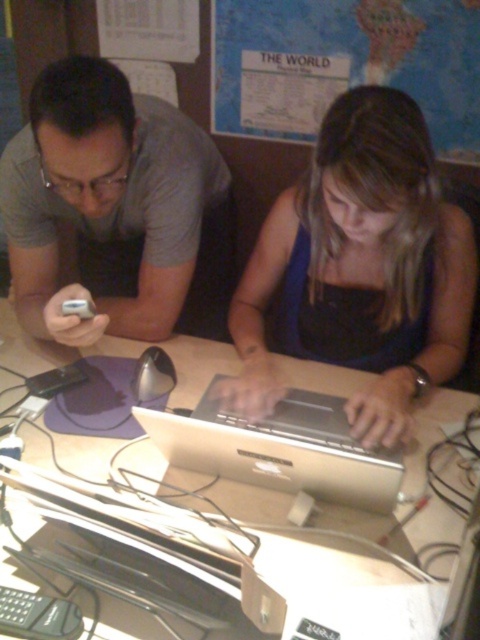
You are an interior designer assessing the desk space. The matte gray shirt at left and the white glossy table at center are both in your view. Which object is larger in size?

The matte gray shirt at left is smaller than the white glossy table at center, so the white glossy table at center is larger in size.

You are a photographer taking a picture of the scene. The matte gray shirt at left and the white glossy table at center are both in your view. Which object will appear larger in your photo?

The matte gray shirt at left will appear larger in the photo because it is much taller than the white glossy table at center.

You are a delivery robot trying to place a package on the desk. The package must be placed at point (113, 209). What object is at that location?

The matte gray shirt at left is located at point (113, 209).